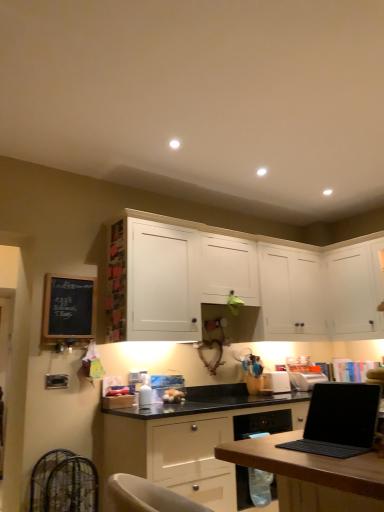
Question: From a real-world perspective, is matte white cabinet at center, the 1th cabinetry positioned from the bottom, positioned under black chalkboard at left based on gravity?

Choices:
 (A) no
 (B) yes

Answer: (B)

Question: Does matte white cabinet at center, acting as the 3th cabinetry starting from the top, appear on the left side of black chalkboard at left?

Choices:
 (A) yes
 (B) no

Answer: (B)

Question: Is matte white cabinet at center, acting as the 3th cabinetry starting from the top, wider than black chalkboard at left?

Choices:
 (A) yes
 (B) no

Answer: (A)

Question: Does matte white cabinet at center, the 1th cabinetry positioned from the bottom, come behind black chalkboard at left?

Choices:
 (A) no
 (B) yes

Answer: (A)

Question: Is matte white cabinet at center, acting as the 3th cabinetry starting from the top, taller than black chalkboard at left?

Choices:
 (A) yes
 (B) no

Answer: (A)

Question: Is black matte laptop at lower right taller or shorter than black chalkboard at left?

Choices:
 (A) short
 (B) tall

Answer: (A)

Question: Based on their positions, is black matte laptop at lower right located to the left or right of black chalkboard at left?

Choices:
 (A) right
 (B) left

Answer: (A)

Question: From the image's perspective, is black matte laptop at lower right above or below black chalkboard at left?

Choices:
 (A) below
 (B) above

Answer: (A)

Question: Looking at their shapes, would you say black matte laptop at lower right is wider or thinner than black chalkboard at left?

Choices:
 (A) thin
 (B) wide

Answer: (B)

Question: Looking at their shapes, would you say white matte cabinet at upper right, which is the 2th cabinetry in top-to-bottom order, is wider or thinner than wooden photo frame at upper center?

Choices:
 (A) wide
 (B) thin

Answer: (A)

Question: Based on their positions, is white matte cabinet at upper right, placed as the 2th cabinetry when sorted from bottom to top, located to the left or right of wooden photo frame at upper center?

Choices:
 (A) left
 (B) right

Answer: (B)

Question: Choose the correct answer: Is white matte cabinet at upper right, placed as the 2th cabinetry when sorted from bottom to top, inside wooden photo frame at upper center or outside it?

Choices:
 (A) outside
 (B) inside

Answer: (A)

Question: In the image, is white matte cabinet at upper right, which is the 2th cabinetry in top-to-bottom order, positioned in front of or behind wooden photo frame at upper center?

Choices:
 (A) front
 (B) behind

Answer: (B)

Question: Considering their positions, is black chalkboard at left located in front of or behind black matte laptop at lower right?

Choices:
 (A) front
 (B) behind

Answer: (B)

Question: Is point [87, 283] positioned closer to the camera than point [316, 445]?

Choices:
 (A) closer
 (B) farther

Answer: (B)